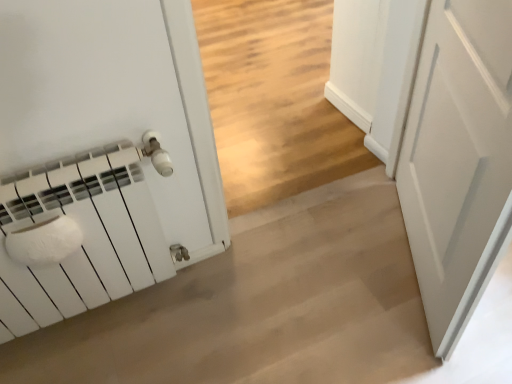
The width and height of the screenshot is (512, 384). What do you see at coordinates (458, 160) in the screenshot?
I see `white matte door at right` at bounding box center [458, 160].

In order to face white matte door at right, should I rotate leftwards or rightwards?

A 23.291 degree turn to the right will do.

Identify the location of white matte door at right. (458, 160).

What do you see at coordinates (260, 305) in the screenshot?
I see `white matte radiator at left` at bounding box center [260, 305].

At what (x,y) coordinates should I click in order to perform the action: click on white matte radiator at left. Please return your answer as a coordinate pair (x, y). The height and width of the screenshot is (384, 512). Looking at the image, I should click on (260, 305).

Image resolution: width=512 pixels, height=384 pixels. Identify the location of white matte door at right. (458, 160).

Which is more to the right, white matte door at right or white matte radiator at left?

Positioned to the right is white matte door at right.

In the image, is white matte door at right positioned in front of or behind white matte radiator at left?

white matte door at right is positioned closer to the viewer than white matte radiator at left.

Considering the positions of points (508, 73) and (360, 218), is point (508, 73) closer to camera compared to point (360, 218)?

Yes.

From the image's perspective, is white matte door at right located above or below white matte radiator at left?

white matte door at right is above white matte radiator at left.

From a real-world perspective, which is physically below, white matte door at right or white matte radiator at left?

white matte radiator at left, from a real-world perspective.

Which of these two, white matte door at right or white matte radiator at left, is wider?

Wider between the two is white matte radiator at left.

Between white matte door at right and white matte radiator at left, which one has more height?

white matte door at right is taller.

Considering the sizes of objects white matte door at right and white matte radiator at left in the image provided, who is smaller, white matte door at right or white matte radiator at left?

white matte door at right.

Is white matte radiator at left located within white matte door at right?

No, white matte radiator at left is not inside white matte door at right.

Is white matte door at right in contact with white matte radiator at left?

No, white matte door at right is not beside white matte radiator at left.

Based on the photo, is white matte door at right oriented away from white matte radiator at left?

white matte door at right is not turned away from white matte radiator at left.

What's the angular difference between white matte door at right and white matte radiator at left's facing directions?

60 degrees separate the facing orientations of white matte door at right and white matte radiator at left.

Consider the image. Measure the distance between white matte door at right and white matte radiator at left.

They are 21.46 inches apart.

Find the location of `concrete that appears behind the white matte door at right`. concrete that appears behind the white matte door at right is located at coordinates (260, 305).

Considering the relative positions of white matte radiator at left and white matte door at right in the image provided, is white matte radiator at left to the left or to the right of white matte door at right?

In the image, white matte radiator at left appears on the left side of white matte door at right.

Which object is further away from the camera, white matte radiator at left or white matte door at right?

white matte radiator at left is more distant.

Is point (257, 289) behind point (467, 239)?

That is True.

In the scene shown: From the image's perspective, between white matte radiator at left and white matte door at right, who is located below?

white matte radiator at left is shown below in the image.

From a real-world perspective, relative to white matte door at right, is white matte radiator at left vertically above or below?

white matte radiator at left is below white matte door at right.

Which object is wider, white matte radiator at left or white matte door at right?

With larger width is white matte radiator at left.

Which of these two, white matte radiator at left or white matte door at right, stands shorter?

Standing shorter between the two is white matte radiator at left.

Considering the sizes of white matte radiator at left and white matte door at right in the image, is white matte radiator at left bigger or smaller than white matte door at right?

Clearly, white matte radiator at left is larger in size than white matte door at right.

Which is correct: white matte radiator at left is inside white matte door at right, or outside of it?

white matte radiator at left is not inside white matte door at right, it's outside.

Is white matte radiator at left in contact with white matte door at right?

white matte radiator at left and white matte door at right are clearly separated.

Is white matte radiator at left oriented towards white matte door at right?

A: No, white matte radiator at left is not aimed at white matte door at right.

Can you tell me how much white matte radiator at left and white matte door at right differ in facing direction?

white matte radiator at left and white matte door at right are facing 60 degrees away from each other.

In the scene shown: How much distance is there between white matte radiator at left and white matte door at right?

They are 21.46 inches apart.

The height and width of the screenshot is (384, 512). What are the coordinates of `door above the white matte radiator at left (from the image's perspective)` in the screenshot? It's located at (458, 160).

Locate an element on the screen. concrete located behind the white matte door at right is located at coordinates (260, 305).

The height and width of the screenshot is (384, 512). In order to click on concrete below the white matte door at right (from a real-world perspective) in this screenshot , I will do `click(260, 305)`.